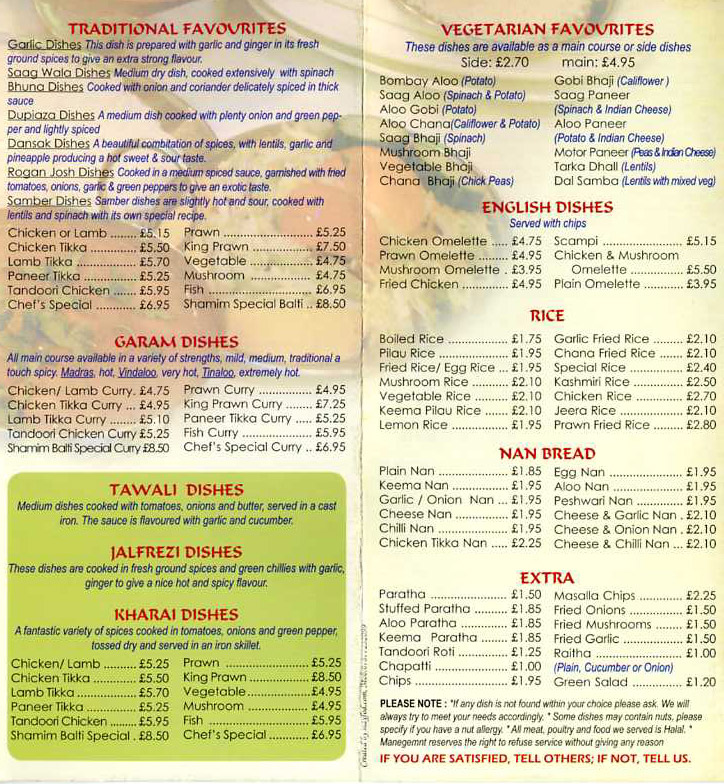
Identify the location of english dishes. (442, 241), (447, 256), (447, 270), (444, 282), (586, 242), (592, 256), (594, 282).